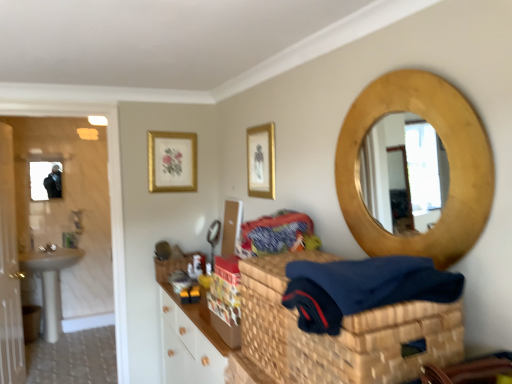
Question: From the image's perspective, is white glossy door at left located above or below patterned fabric at center?

Choices:
 (A) above
 (B) below

Answer: (B)

Question: Relative to patterned fabric at center, is white glossy door at left in front or behind?

Choices:
 (A) front
 (B) behind

Answer: (B)

Question: Considering the real-world distances, which object is farthest from the gold-framed artwork at upper center, the first picture frame in the back-to-front sequence?

Choices:
 (A) patterned fabric at center
 (B) white glossy sink at left
 (C) gold textured mirror at upper right
 (D) gold metallic picture frame at upper center, the 1th picture frame when ordered from front to back
 (E) gold wooden mirror at upper right

Answer: (B)

Question: Which object is the farthest from the gold textured mirror at upper right?

Choices:
 (A) white glossy sink at left
 (B) gold wooden mirror at upper right
 (C) gold metallic picture frame at upper center, marked as the 2th picture frame in a back-to-front arrangement
 (D) gold-framed artwork at upper center, the 1th picture frame when ordered from left to right
 (E) patterned fabric at center

Answer: (B)